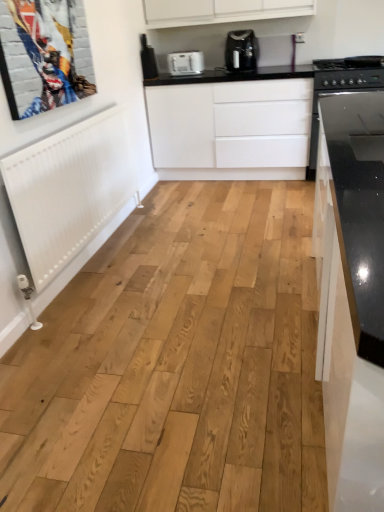
Question: From the image's perspective, is white matte cabinet at center on top of black glass stove at right?

Choices:
 (A) yes
 (B) no

Answer: (B)

Question: From a real-world perspective, is white matte cabinet at center on black glass stove at right?

Choices:
 (A) yes
 (B) no

Answer: (B)

Question: Is white matte cabinet at center not inside black glass stove at right?

Choices:
 (A) no
 (B) yes

Answer: (B)

Question: From the image's perspective, is white matte cabinet at center located beneath black glass stove at right?

Choices:
 (A) no
 (B) yes

Answer: (B)

Question: Is black glass stove at right completely or partially inside white matte cabinet at center?

Choices:
 (A) no
 (B) yes

Answer: (A)

Question: Is white matte cabinet at center wider than black glass stove at right?

Choices:
 (A) no
 (B) yes

Answer: (A)

Question: Does black glass stove at right have a greater width compared to white plastic toaster at upper center?

Choices:
 (A) no
 (B) yes

Answer: (B)

Question: Can you confirm if black glass stove at right is taller than white plastic toaster at upper center?

Choices:
 (A) no
 (B) yes

Answer: (A)

Question: Considering the relative positions of black glass stove at right and white plastic toaster at upper center in the image provided, is black glass stove at right behind white plastic toaster at upper center?

Choices:
 (A) yes
 (B) no

Answer: (B)

Question: From the image's perspective, does black glass stove at right appear lower than white plastic toaster at upper center?

Choices:
 (A) yes
 (B) no

Answer: (A)

Question: Is white plastic toaster at upper center at the back of black glass stove at right?

Choices:
 (A) no
 (B) yes

Answer: (A)

Question: Is black glass stove at right at the right side of white plastic toaster at upper center?

Choices:
 (A) yes
 (B) no

Answer: (A)

Question: Can you confirm if white plastic toaster at upper center is thinner than white matte cabinet at center?

Choices:
 (A) yes
 (B) no

Answer: (A)